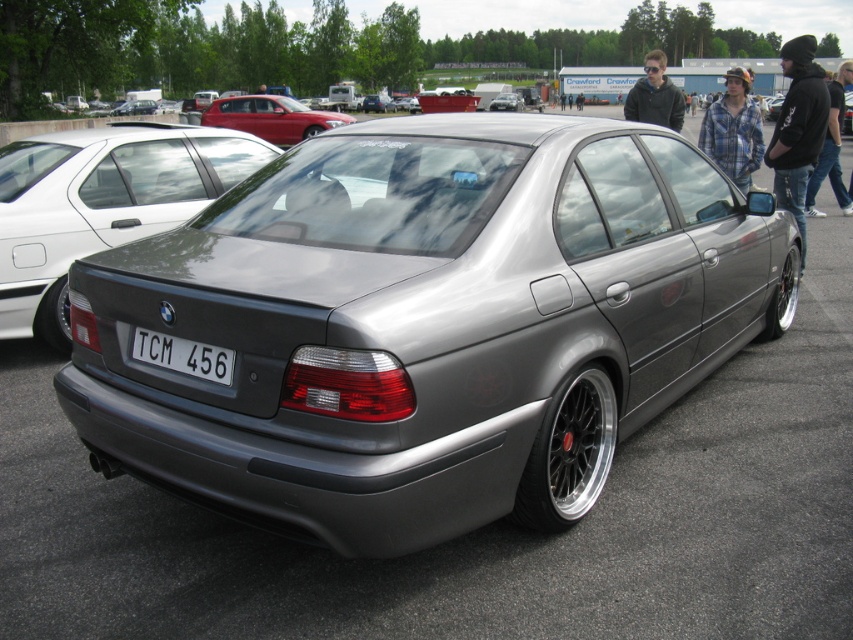
Is satin silver car at center positioned behind satin silver sedan at center?

No, satin silver car at center is closer to the viewer.

Can you confirm if satin silver car at center is thinner than satin silver sedan at center?

No, satin silver car at center is not thinner than satin silver sedan at center.

Locate an element on the screen. The height and width of the screenshot is (640, 853). satin silver car at center is located at coordinates (506, 102).

What are the coordinates of `satin silver car at center` in the screenshot? It's located at (506, 102).

Who is positioned more to the right, metallic red sedan at upper center or white plastic license plate at center?

white plastic license plate at center is more to the right.

Identify the location of metallic red sedan at upper center. The width and height of the screenshot is (853, 640). (271, 116).

Does point (212, 125) come behind point (161, 346)?

Yes, point (212, 125) is behind point (161, 346).

The width and height of the screenshot is (853, 640). I want to click on metallic red sedan at upper center, so click(271, 116).

Is white plastic license plate at center wider than satin silver sedan at center?

No, white plastic license plate at center is not wider than satin silver sedan at center.

Is white plastic license plate at center bigger than satin silver sedan at center?

Incorrect, white plastic license plate at center is not larger than satin silver sedan at center.

What do you see at coordinates (183, 355) in the screenshot? The width and height of the screenshot is (853, 640). I see `white plastic license plate at center` at bounding box center [183, 355].

Where is `white plastic license plate at center`? The width and height of the screenshot is (853, 640). white plastic license plate at center is located at coordinates (183, 355).